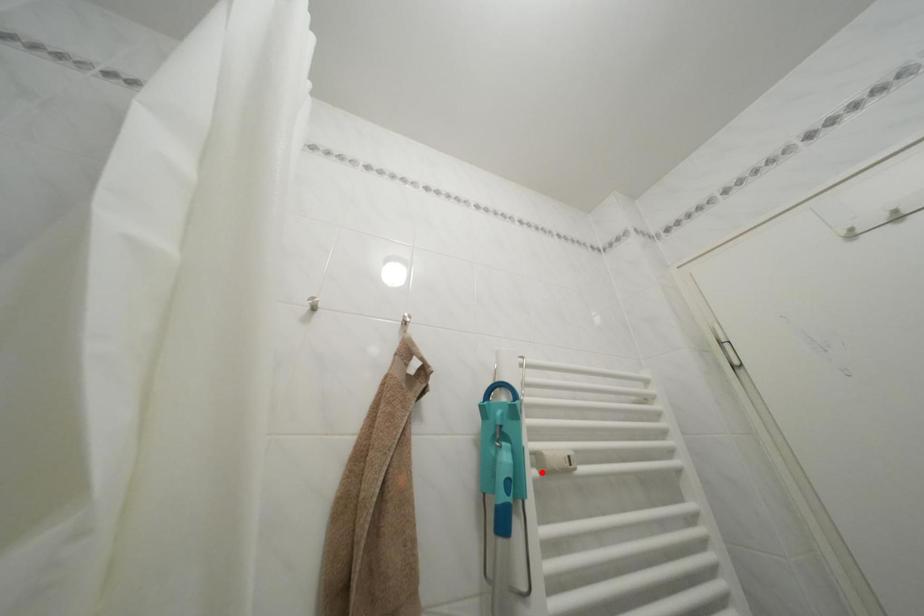
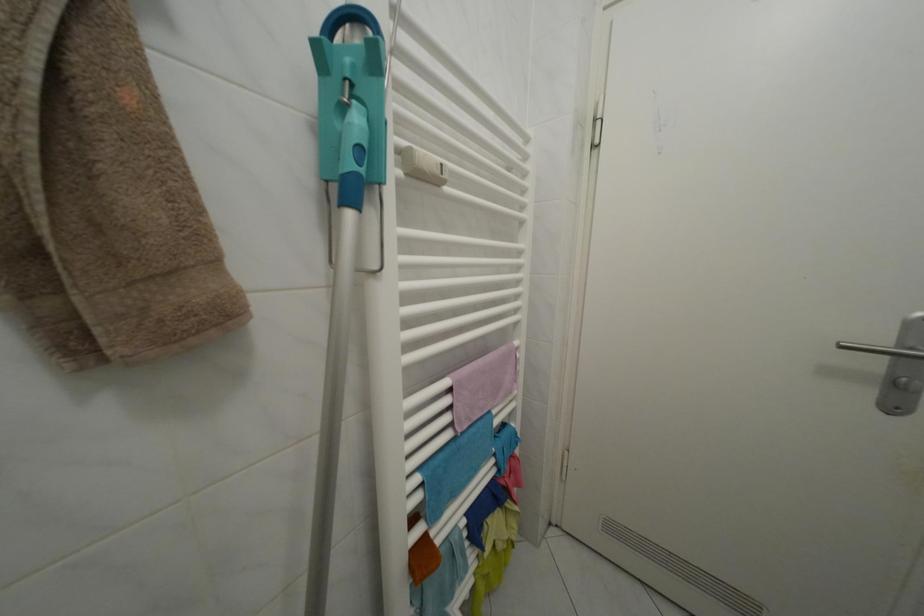
Find the pixel in the second image that matches the highlighted location in the first image.

(406, 172)